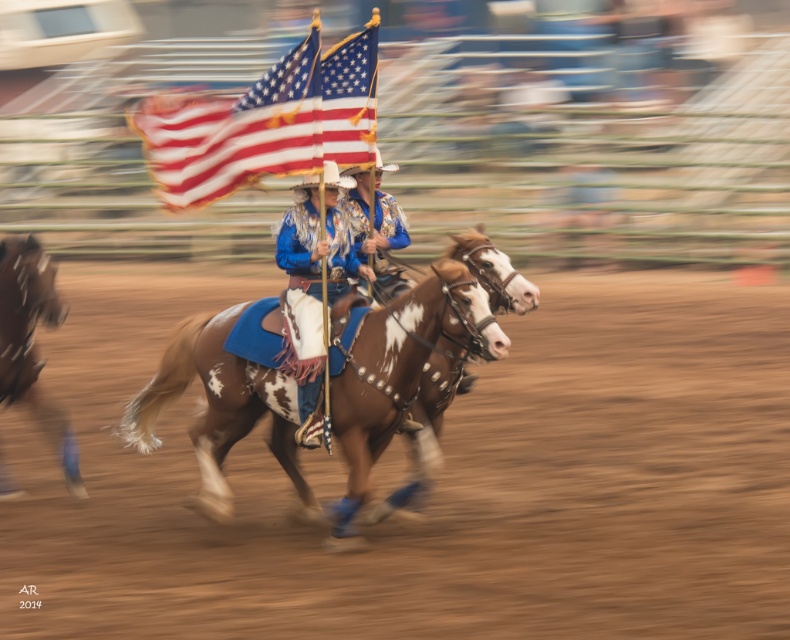
Question: Among these points, which one is nearest to the camera?

Choices:
 (A) (19, 323)
 (B) (367, 212)

Answer: (A)

Question: Is brown speckled horse at center to the right of blue satin cowboy hat at center from the viewer's perspective?

Choices:
 (A) no
 (B) yes

Answer: (B)

Question: Is brown speckled horse at left below shiny blue shirt at center?

Choices:
 (A) yes
 (B) no

Answer: (A)

Question: Estimate the real-world distances between objects in this image. Which object is farther from the blue satin cowboy hat at center?

Choices:
 (A) american flag at center
 (B) brown speckled horse at center

Answer: (A)

Question: Which of the following is the closest to the observer?

Choices:
 (A) brown speckled horse at center
 (B) blue denim jacket at center

Answer: (A)

Question: Is american flag at center below blue satin cowboy hat at center?

Choices:
 (A) no
 (B) yes

Answer: (A)